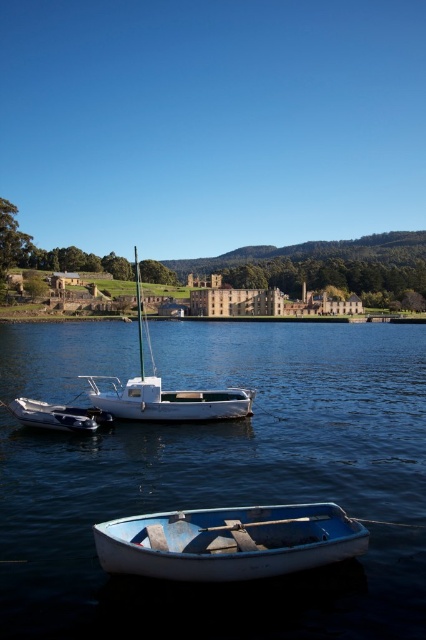
Can you confirm if blue glossy water at center is positioned to the right of white matte sailboat at center?

Yes, blue glossy water at center is to the right of white matte sailboat at center.

Does point (400, 509) lie in front of point (232, 417)?

Yes, it is.

You are a GUI agent. You are given a task and a screenshot of the screen. Output one action in this format:
    pyautogui.click(x=<x>, y=<y>)
    Task: Click on the blue glossy water at center
    The image size is (426, 640).
    Given the screenshot: What is the action you would take?
    pyautogui.click(x=232, y=490)

Between white matte sailboat at center and metallic blue dinghy at lower center, which one has more height?

With more height is white matte sailboat at center.

Image resolution: width=426 pixels, height=640 pixels. Describe the element at coordinates (164, 390) in the screenshot. I see `white matte sailboat at center` at that location.

Find the location of a particular element. Image resolution: width=426 pixels, height=640 pixels. white matte sailboat at center is located at coordinates (164, 390).

Is white matte rowboat at lower center taller than metallic blue dinghy at lower center?

Correct, white matte rowboat at lower center is much taller as metallic blue dinghy at lower center.

Who is lower down, white matte rowboat at lower center or metallic blue dinghy at lower center?

Positioned lower is white matte rowboat at lower center.

At what (x,y) coordinates should I click in order to perform the action: click on white matte rowboat at lower center. Please return your answer as a coordinate pair (x, y). Image resolution: width=426 pixels, height=640 pixels. Looking at the image, I should click on (229, 541).

The width and height of the screenshot is (426, 640). Identify the location of white matte rowboat at lower center. (229, 541).